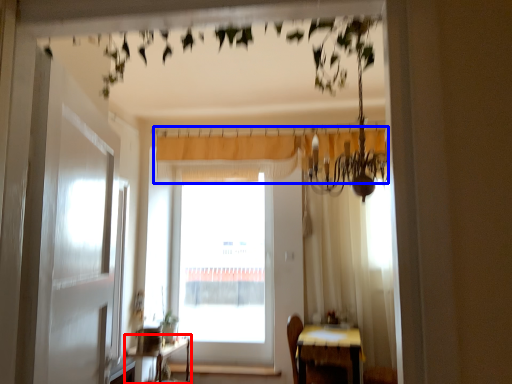
Question: Among these objects, which one is nearest to the camera, table (highlighted by a red box) or curtain (highlighted by a blue box)?

Choices:
 (A) table
 (B) curtain

Answer: (A)